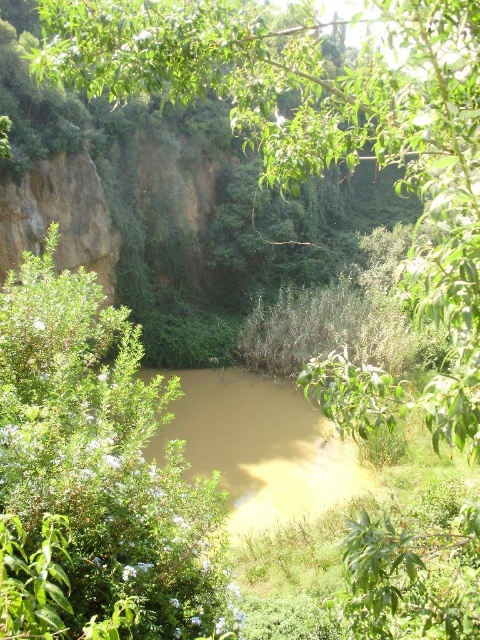
Question: Can you confirm if green leafy tree at center is smaller than brown muddy water at center?

Choices:
 (A) no
 (B) yes

Answer: (A)

Question: Which of the following is the closest to the observer?

Choices:
 (A) green leafy tree at center
 (B) brown muddy water at center

Answer: (A)

Question: Does green leafy tree at center appear on the right side of brown muddy water at center?

Choices:
 (A) no
 (B) yes

Answer: (B)

Question: Is green leafy tree at center thinner than brown muddy water at center?

Choices:
 (A) yes
 (B) no

Answer: (B)

Question: Which point is closer to the camera?

Choices:
 (A) (464, 100)
 (B) (336, 440)

Answer: (A)